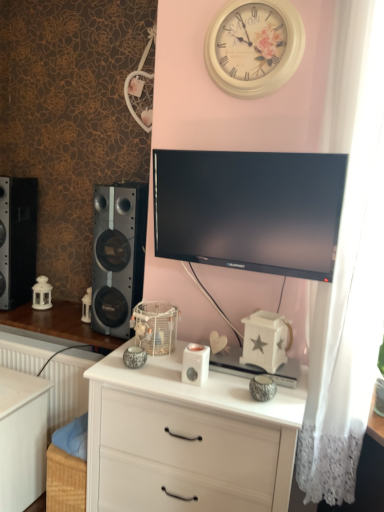
Question: Is black matte speaker at left, acting as the second speaker starting from the right, not near white plastic ipod at center?

Choices:
 (A) no
 (B) yes

Answer: (B)

Question: Does black matte speaker at left, the first speaker in the left-to-right sequence, have a lesser width compared to white plastic ipod at center?

Choices:
 (A) no
 (B) yes

Answer: (A)

Question: From a real-world perspective, is black matte speaker at left, acting as the second speaker starting from the right, physically above white plastic ipod at center?

Choices:
 (A) yes
 (B) no

Answer: (A)

Question: Does black matte speaker at left, acting as the second speaker starting from the right, come behind white plastic ipod at center?

Choices:
 (A) yes
 (B) no

Answer: (A)

Question: From the image's perspective, is black matte speaker at left, the first speaker in the left-to-right sequence, below white plastic ipod at center?

Choices:
 (A) yes
 (B) no

Answer: (B)

Question: Based on their positions, is black matte speaker at left, the first speaker from the right, located to the left or right of white wooden clock at upper center?

Choices:
 (A) left
 (B) right

Answer: (A)

Question: Is black matte speaker at left, the 2th speaker when ordered from left to right, in front of or behind white wooden clock at upper center in the image?

Choices:
 (A) behind
 (B) front

Answer: (A)

Question: In terms of width, does black matte speaker at left, the first speaker from the right, look wider or thinner when compared to white wooden clock at upper center?

Choices:
 (A) wide
 (B) thin

Answer: (A)

Question: From their relative heights in the image, would you say black matte speaker at left, the first speaker from the right, is taller or shorter than white wooden clock at upper center?

Choices:
 (A) tall
 (B) short

Answer: (A)

Question: Based on their positions, is black matte speaker at left, acting as the second speaker starting from the right, located to the left or right of white wood chest of drawers at center?

Choices:
 (A) left
 (B) right

Answer: (A)

Question: In the image, is black matte speaker at left, acting as the second speaker starting from the right, positioned in front of or behind white wood chest of drawers at center?

Choices:
 (A) front
 (B) behind

Answer: (B)

Question: From a real-world perspective, is black matte speaker at left, acting as the second speaker starting from the right, above or below white wood chest of drawers at center?

Choices:
 (A) below
 (B) above

Answer: (B)

Question: In terms of width, does black matte speaker at left, the first speaker in the left-to-right sequence, look wider or thinner when compared to white wood chest of drawers at center?

Choices:
 (A) wide
 (B) thin

Answer: (B)

Question: Does point (31, 374) appear closer or farther from the camera than point (97, 225)?

Choices:
 (A) closer
 (B) farther

Answer: (B)

Question: From the image's perspective, is white wood changing table at lower left above or below black matte speaker at left, the first speaker from the right?

Choices:
 (A) above
 (B) below

Answer: (B)